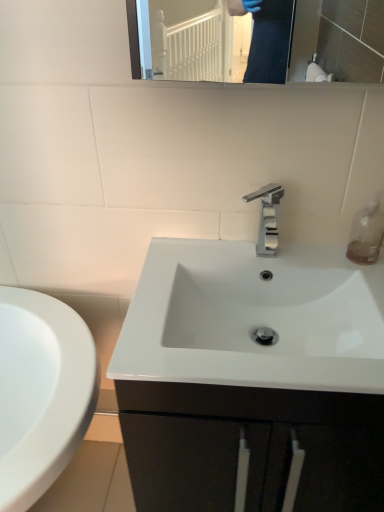
At what (x,y) coordinates should I click in order to perform the action: click on vacant space situated on the left part of transparent plastic soap dispenser at upper right. Please return your answer as a coordinate pair (x, y). Looking at the image, I should click on (306, 257).